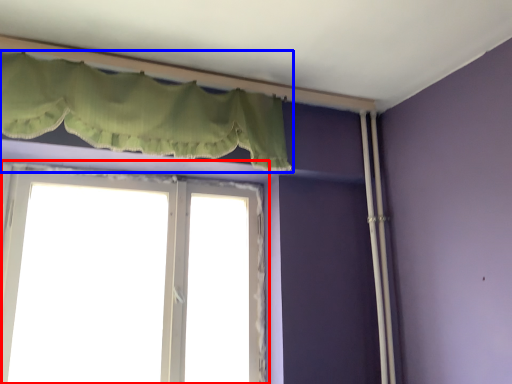
Question: Which object appears farthest to the camera in this image, window (highlighted by a red box) or curtain (highlighted by a blue box)?

Choices:
 (A) window
 (B) curtain

Answer: (A)